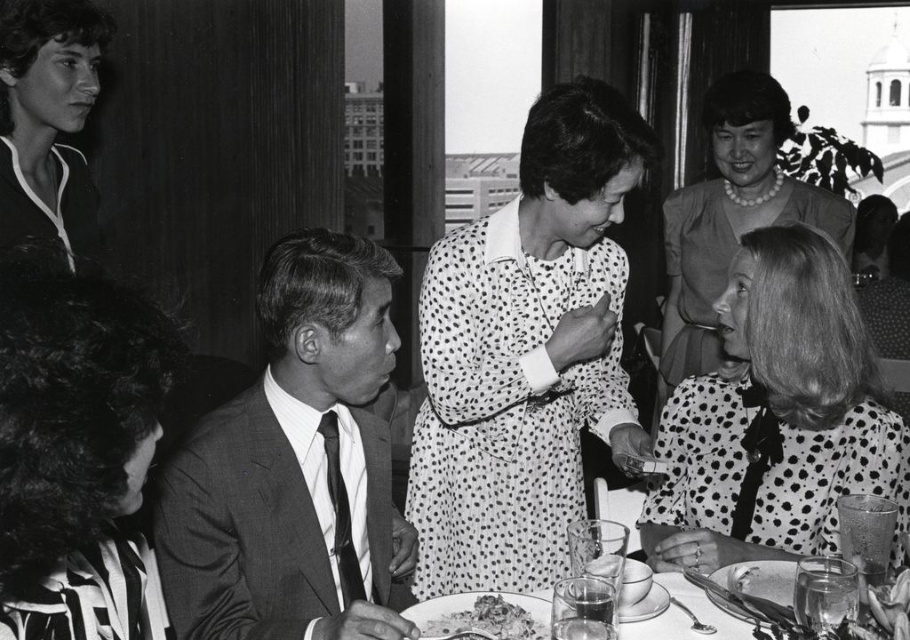
Question: Based on their relative distances, which object is farther from the smooth gray suit at center?

Choices:
 (A) spotted fabric blouse at lower right
 (B) crumbly brown bread at lower center
 (C) striped fabric blouse at lower left

Answer: (A)

Question: Among these objects, which one is farthest from the camera?

Choices:
 (A) spotted fabric blouse at lower right
 (B) smooth gray suit at center
 (C) striped fabric blouse at lower left
 (D) crumbly brown bread at lower center

Answer: (A)

Question: Can you confirm if white dotted dress at center is positioned above striped fabric blouse at lower left?

Choices:
 (A) yes
 (B) no

Answer: (A)

Question: Which object appears farthest from the camera in this image?

Choices:
 (A) striped fabric blouse at lower left
 (B) smooth gray suit at center
 (C) spotted fabric blouse at lower right

Answer: (C)

Question: Considering the relative positions of striped fabric blouse at lower left and smooth glass plate at center in the image provided, where is striped fabric blouse at lower left located with respect to smooth glass plate at center?

Choices:
 (A) right
 (B) left

Answer: (B)

Question: Does polka dot dress at center appear under smooth glass plate at center?

Choices:
 (A) no
 (B) yes

Answer: (A)